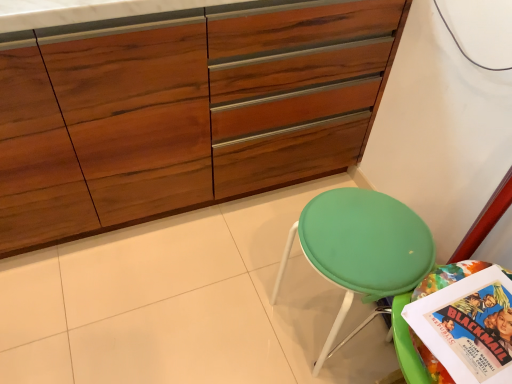
The height and width of the screenshot is (384, 512). I want to click on empty space that is ontop of green fabric stool at lower right (from a real-world perspective), so click(x=362, y=232).